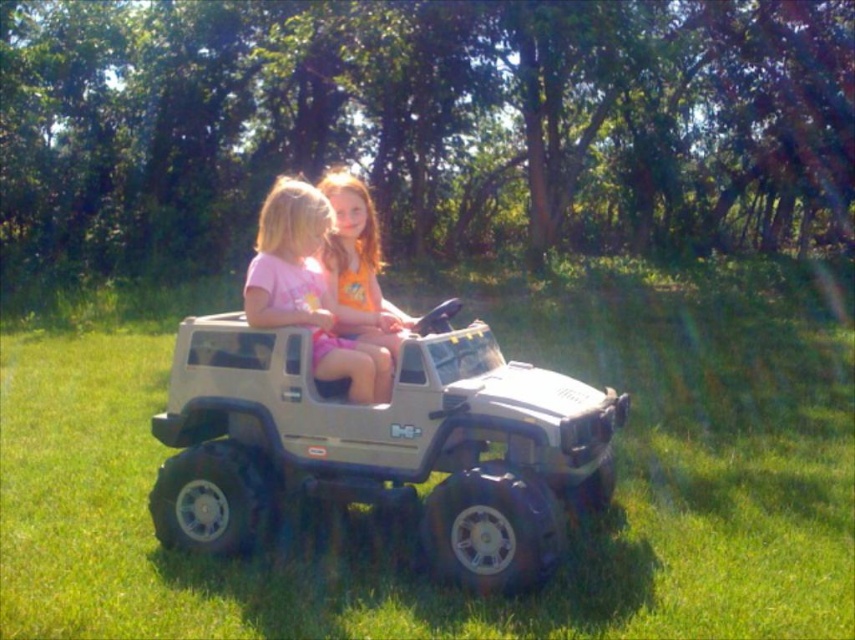
Question: Is matte pink shirt at center to the left of orange cotton shirt at center from the viewer's perspective?

Choices:
 (A) no
 (B) yes

Answer: (A)

Question: Is matte silver toy jeep at center wider than orange cotton shirt at center?

Choices:
 (A) no
 (B) yes

Answer: (A)

Question: Can you confirm if green grass at center is thinner than matte pink shirt at center?

Choices:
 (A) no
 (B) yes

Answer: (A)

Question: Which object appears closest to the camera in this image?

Choices:
 (A) matte pink shirt at center
 (B) matte silver toy jeep at center
 (C) green grass at center

Answer: (C)

Question: Based on their relative distances, which object is farther from the matte pink shirt at center?

Choices:
 (A) orange cotton shirt at center
 (B) matte silver toy jeep at center

Answer: (A)

Question: Which point appears farthest from the camera in this image?

Choices:
 (A) (370, 396)
 (B) (622, 540)
 (C) (240, 362)
 (D) (372, 291)

Answer: (D)